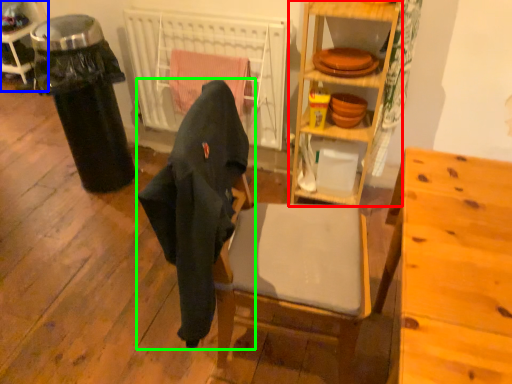
Question: Which is farther away from shelf (highlighted by a red box)? cabinetry (highlighted by a blue box) or chair (highlighted by a green box)?

Choices:
 (A) cabinetry
 (B) chair

Answer: (A)